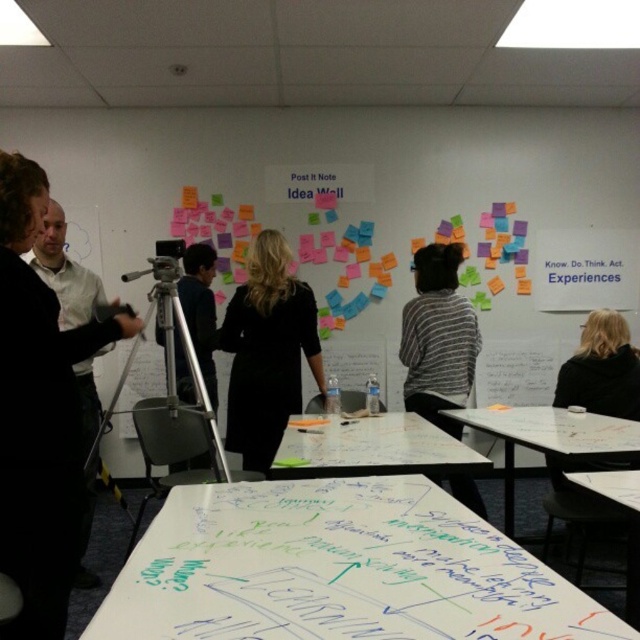
Who is lower down, silver metallic tripod at left or blonde hair at upper right?

silver metallic tripod at left is lower down.

Describe the element at coordinates (173, 380) in the screenshot. This screenshot has width=640, height=640. I see `silver metallic tripod at left` at that location.

The width and height of the screenshot is (640, 640). What are the coordinates of `silver metallic tripod at left` in the screenshot? It's located at coord(173,380).

Who is more distant from viewer, (387, 570) or (56, 552)?

The point (56, 552) is behind.

Between whiteboard paper at center and black fabric shirt at left, which one appears on the left side from the viewer's perspective?

From the viewer's perspective, black fabric shirt at left appears more on the left side.

Is point (620, 630) positioned before point (22, 516)?

Yes, it is.

Locate an element on the screen. Image resolution: width=640 pixels, height=640 pixels. whiteboard paper at center is located at coordinates (337, 570).

Which is below, white glossy table at center or white paperboard at lower right?

white paperboard at lower right

Does point (440, 445) come behind point (637, 589)?

Yes.

Between point (360, 429) and point (628, 502), which one is positioned in front?

Point (628, 502) is in front.

The height and width of the screenshot is (640, 640). I want to click on white glossy table at center, so click(x=378, y=451).